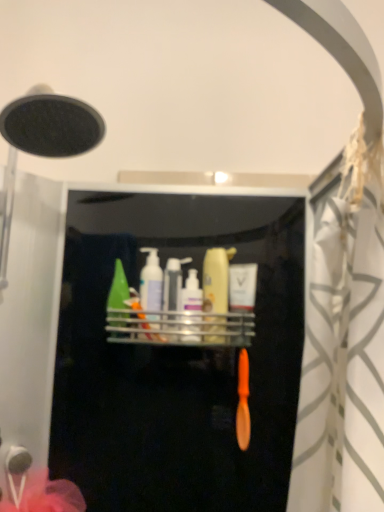
What is the approximate width of matte white lotion at center, which is counted as the first toiletry, starting from the right?

matte white lotion at center, which is counted as the first toiletry, starting from the right, is 5.07 centimeters wide.

Where is `matte white lotion at center, which is counted as the first toiletry, starting from the right`? The width and height of the screenshot is (384, 512). matte white lotion at center, which is counted as the first toiletry, starting from the right is located at coordinates (243, 295).

This screenshot has height=512, width=384. I want to click on matte yellow bottle at center, which is the 2th toiletry from right to left, so click(x=216, y=293).

What do you see at coordinates (118, 298) in the screenshot? The image size is (384, 512). I see `green matte bottle at center, the first toiletry from the left` at bounding box center [118, 298].

Image resolution: width=384 pixels, height=512 pixels. Find the location of `matte white lotion at center, which is counted as the first toiletry, starting from the right`. matte white lotion at center, which is counted as the first toiletry, starting from the right is located at coordinates (243, 295).

Who is bigger, white matte pump bottle at center, positioned as the fourth toiletry in right-to-left order, or matte white lotion at center, which is counted as the first toiletry, starting from the right?

white matte pump bottle at center, positioned as the fourth toiletry in right-to-left order.

Considering the sizes of objects white matte pump bottle at center, positioned as the fourth toiletry in right-to-left order, and matte white lotion at center, the 5th toiletry positioned from the left, in the image provided, who is taller, white matte pump bottle at center, positioned as the fourth toiletry in right-to-left order, or matte white lotion at center, the 5th toiletry positioned from the left,?

white matte pump bottle at center, positioned as the fourth toiletry in right-to-left order, is taller.

In terms of width, does white matte pump bottle at center, positioned as the 2th toiletry in left-to-right order, look wider or thinner when compared to matte white lotion at center, which is counted as the first toiletry, starting from the right?

In the image, white matte pump bottle at center, positioned as the 2th toiletry in left-to-right order, appears to be wider than matte white lotion at center, which is counted as the first toiletry, starting from the right.

From a real-world perspective, does green matte bottle at center, the first toiletry from the left, sit lower than metallic silver shelf at center?

No.

Consider the image. Can you confirm if green matte bottle at center, the first toiletry from the left, is shorter than metallic silver shelf at center?

Incorrect, the height of green matte bottle at center, the first toiletry from the left, does not fall short of that of metallic silver shelf at center.

Is green matte bottle at center, the 5th toiletry from the right, turned away from metallic silver shelf at center?

No, green matte bottle at center, the 5th toiletry from the right,'s orientation is not away from metallic silver shelf at center.

Which toiletry is the 4th one when counting from the back of the metallic silver shelf at center? Please provide its 2D coordinates.

[(118, 298)]

Between matte yellow bottle at center, which is the 2th toiletry from right to left, and matte white lotion at center, the 5th toiletry positioned from the left, which one has larger width?

matte yellow bottle at center, which is the 2th toiletry from right to left.

Who is bigger, matte yellow bottle at center, which is the 2th toiletry from right to left, or matte white lotion at center, the 5th toiletry positioned from the left?

matte yellow bottle at center, which is the 2th toiletry from right to left.

What's the angular difference between matte yellow bottle at center, which is the 2th toiletry from right to left, and matte white lotion at center, the 5th toiletry positioned from the left,'s facing directions?

The angular difference between matte yellow bottle at center, which is the 2th toiletry from right to left, and matte white lotion at center, the 5th toiletry positioned from the left, is 0.00538 degrees.

Is metallic silver shelf at center positioned beyond the bounds of matte white lotion at center, which is counted as the first toiletry, starting from the right?

That's correct, metallic silver shelf at center is outside of matte white lotion at center, which is counted as the first toiletry, starting from the right.

Can you see metallic silver shelf at center touching matte white lotion at center, which is counted as the first toiletry, starting from the right?

No, metallic silver shelf at center is not next to matte white lotion at center, which is counted as the first toiletry, starting from the right.

Can you confirm if metallic silver shelf at center is smaller than matte white lotion at center, the 5th toiletry positioned from the left?

No, metallic silver shelf at center is not smaller than matte white lotion at center, the 5th toiletry positioned from the left.

Is metallic silver shelf at center shorter than matte white lotion at center, the 5th toiletry positioned from the left?

Yes.

Which object is wider, matte yellow bottle at center, which is the 2th toiletry from right to left, or translucent plastic bottle at center, placed as the 3th toiletry when sorted from left to right?

With larger width is translucent plastic bottle at center, placed as the 3th toiletry when sorted from left to right.

Is matte yellow bottle at center, which is the 4th toiletry from left to right, oriented away from translucent plastic bottle at center, placed as the 3th toiletry when sorted from left to right?

No, matte yellow bottle at center, which is the 4th toiletry from left to right, is not facing away from translucent plastic bottle at center, placed as the 3th toiletry when sorted from left to right.

Can you tell me how much matte yellow bottle at center, which is the 2th toiletry from right to left, and translucent plastic bottle at center, placed as the 3th toiletry when sorted from left to right, differ in facing direction?

matte yellow bottle at center, which is the 2th toiletry from right to left, and translucent plastic bottle at center, placed as the 3th toiletry when sorted from left to right, are facing 7.54e-05 degrees away from each other.

Could you measure the distance between matte yellow bottle at center, which is the 4th toiletry from left to right, and translucent plastic bottle at center, arranged as the 3th toiletry when viewed from the right?

They are 3.76 centimeters apart.

Between metallic silver shelf at center and white matte pump bottle at center, positioned as the 2th toiletry in left-to-right order, which one is positioned in front?

metallic silver shelf at center is closer to the camera.

Is metallic silver shelf at center situated inside white matte pump bottle at center, positioned as the fourth toiletry in right-to-left order, or outside?

metallic silver shelf at center is not inside white matte pump bottle at center, positioned as the fourth toiletry in right-to-left order, it's outside.

Does metallic silver shelf at center appear on the right side of white matte pump bottle at center, positioned as the 2th toiletry in left-to-right order?

Yes.

At what (x,y) coordinates should I click in order to perform the action: click on shelf below the matte white lotion at center, the 5th toiletry positioned from the left (from a real-world perspective). Please return your answer as a coordinate pair (x, y). The image size is (384, 512). Looking at the image, I should click on (180, 328).

From a real-world perspective, is matte white lotion at center, the 5th toiletry positioned from the left, above or below metallic silver shelf at center?

Clearly, from a real-world perspective, matte white lotion at center, the 5th toiletry positioned from the left, is above metallic silver shelf at center.

Could you tell me if matte white lotion at center, which is counted as the first toiletry, starting from the right, is facing metallic silver shelf at center?

No, matte white lotion at center, which is counted as the first toiletry, starting from the right, is not oriented towards metallic silver shelf at center.

The height and width of the screenshot is (512, 384). I want to click on the 2nd toiletry in front of the matte white lotion at center, which is counted as the first toiletry, starting from the right, starting your count from the anchor, so click(x=151, y=288).

This screenshot has height=512, width=384. I want to click on shelf to the right of green matte bottle at center, the first toiletry from the left, so click(x=180, y=328).

Estimate the real-world distances between objects in this image. Which object is closer to matte white lotion at center, which is counted as the first toiletry, starting from the right, metallic silver shelf at center or white matte pump bottle at center, positioned as the fourth toiletry in right-to-left order?

metallic silver shelf at center lies closer to matte white lotion at center, which is counted as the first toiletry, starting from the right, than the other object.

When comparing their distances from white matte pump bottle at center, positioned as the fourth toiletry in right-to-left order, does matte yellow bottle at center, which is the 2th toiletry from right to left, or matte white lotion at center, the 5th toiletry positioned from the left, seem further?

matte white lotion at center, the 5th toiletry positioned from the left, is positioned further to the anchor white matte pump bottle at center, positioned as the fourth toiletry in right-to-left order.

Looking at the image, which one is located closer to translucent plastic bottle at center, arranged as the 3th toiletry when viewed from the right, metallic silver shelf at center or matte white lotion at center, the 5th toiletry positioned from the left?

metallic silver shelf at center is positioned closer to the anchor translucent plastic bottle at center, arranged as the 3th toiletry when viewed from the right.

Looking at the image, which one is located further to white matte pump bottle at center, positioned as the 2th toiletry in left-to-right order, matte white lotion at center, which is counted as the first toiletry, starting from the right, or matte yellow bottle at center, which is the 4th toiletry from left to right?

Among the two, matte white lotion at center, which is counted as the first toiletry, starting from the right, is located further to white matte pump bottle at center, positioned as the 2th toiletry in left-to-right order.

Based on their spatial positions, is translucent plastic bottle at center, placed as the 3th toiletry when sorted from left to right, or matte white lotion at center, the 5th toiletry positioned from the left, closer to metallic silver shelf at center?

Among the two, translucent plastic bottle at center, placed as the 3th toiletry when sorted from left to right, is located nearer to metallic silver shelf at center.

Estimate the real-world distances between objects in this image. Which object is closer to translucent plastic bottle at center, placed as the 3th toiletry when sorted from left to right, matte white lotion at center, which is counted as the first toiletry, starting from the right, or metallic silver shelf at center?

metallic silver shelf at center.

Based on their spatial positions, is matte yellow bottle at center, which is the 4th toiletry from left to right, or green matte bottle at center, the 5th toiletry from the right, further from metallic silver shelf at center?

Based on the image, green matte bottle at center, the 5th toiletry from the right, appears to be further to metallic silver shelf at center.

Which object lies nearer to the anchor point matte white lotion at center, which is counted as the first toiletry, starting from the right, green matte bottle at center, the first toiletry from the left, or matte yellow bottle at center, which is the 4th toiletry from left to right?

matte yellow bottle at center, which is the 4th toiletry from left to right, lies closer to matte white lotion at center, which is counted as the first toiletry, starting from the right, than the other object.

Where is `toiletry between white matte pump bottle at center, positioned as the fourth toiletry in right-to-left order, and matte yellow bottle at center, which is the 2th toiletry from right to left, from left to right`? This screenshot has width=384, height=512. toiletry between white matte pump bottle at center, positioned as the fourth toiletry in right-to-left order, and matte yellow bottle at center, which is the 2th toiletry from right to left, from left to right is located at coordinates (191, 309).

Locate an element on the screen. toiletry situated between translucent plastic bottle at center, arranged as the 3th toiletry when viewed from the right, and matte white lotion at center, which is counted as the first toiletry, starting from the right, from left to right is located at coordinates (216, 293).

Locate an element on the screen. shelf situated between green matte bottle at center, the first toiletry from the left, and matte yellow bottle at center, which is the 2th toiletry from right to left, from left to right is located at coordinates (180, 328).

This screenshot has width=384, height=512. Identify the location of toiletry between green matte bottle at center, the first toiletry from the left, and metallic silver shelf at center, in the horizontal direction. (151, 288).